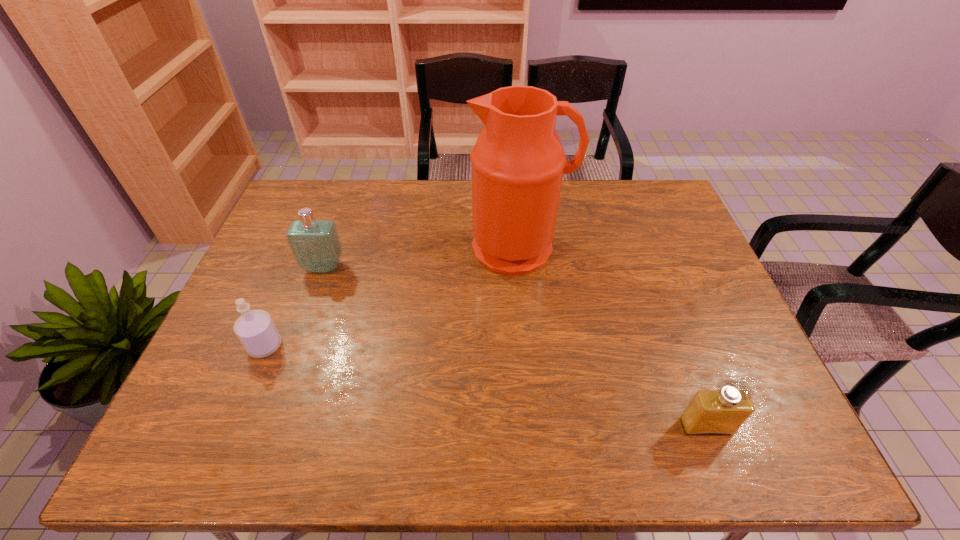
Image resolution: width=960 pixels, height=540 pixels. Find the location of `object at the near edge`. object at the near edge is located at coordinates (722, 412).

Locate an element on the screen. object situated at the right edge is located at coordinates (722, 412).

At what (x,y) coordinates should I click in order to perform the action: click on object that is at the near right corner. Please return your answer as a coordinate pair (x, y). Image resolution: width=960 pixels, height=540 pixels. Looking at the image, I should click on (722, 412).

Identify the location of vacant area at the far edge. The height and width of the screenshot is (540, 960). (584, 211).

Image resolution: width=960 pixels, height=540 pixels. In order to click on vacant area at the near edge of the desktop in this screenshot , I will do `click(620, 435)`.

In the image, there is a desktop. Where is `vacant space at the left edge`? vacant space at the left edge is located at coordinates (252, 398).

Find the location of a particular element. blank space at the right edge of the desktop is located at coordinates (675, 272).

Locate an element on the screen. free space at the far left corner of the desktop is located at coordinates (296, 208).

Where is `vacant region between the second nearest perfume and the second tallest object`? vacant region between the second nearest perfume and the second tallest object is located at coordinates (295, 307).

Locate an element on the screen. free space between the tallest perfume and the third object from left to right is located at coordinates (421, 258).